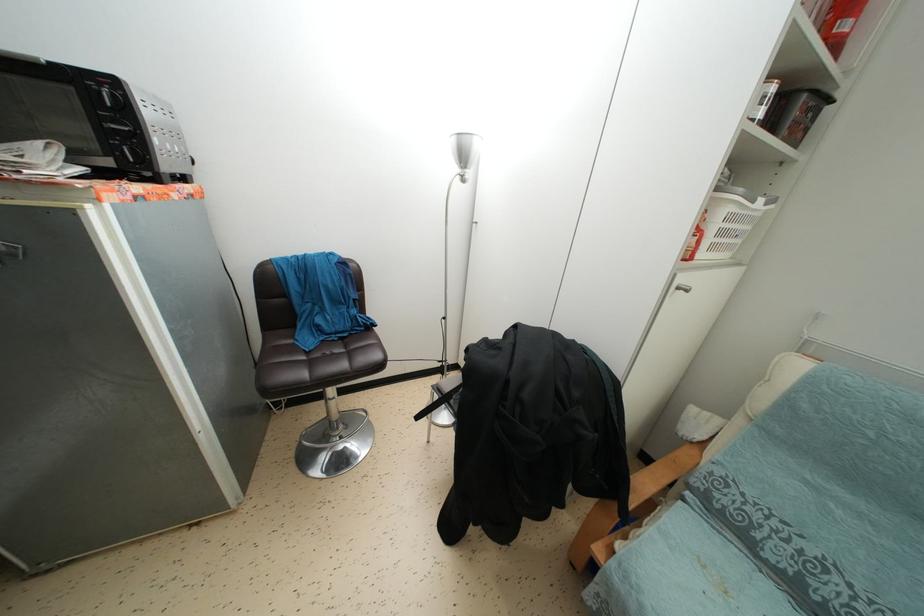
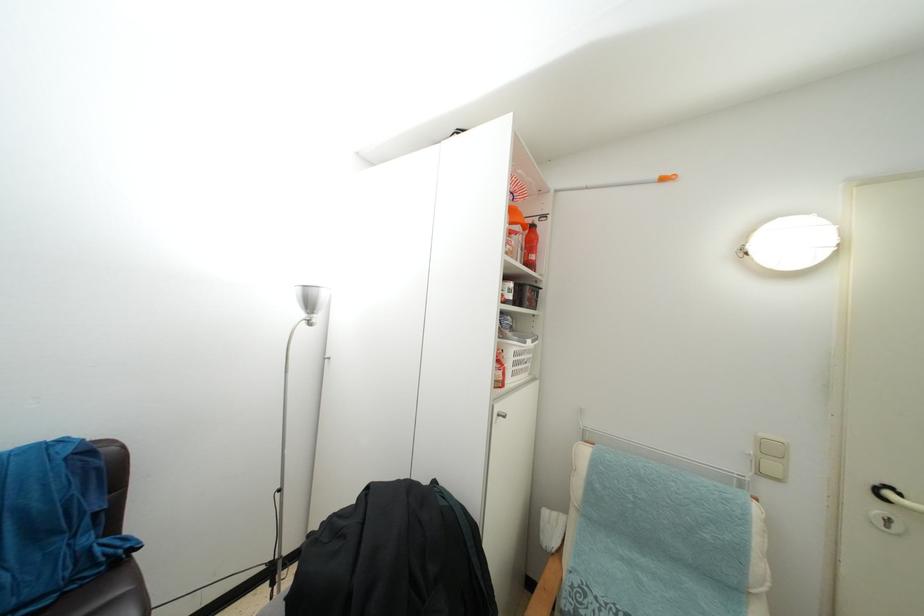
The point at (725,238) is marked in the first image. Where is the corresponding point in the second image?

(519, 370)